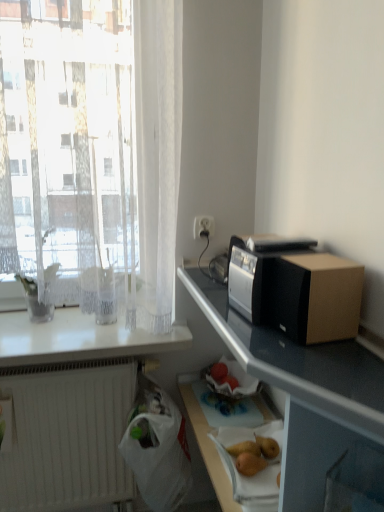
Locate an element on the screen. black plastic microwave at right is located at coordinates (257, 272).

What do you see at coordinates (254, 454) in the screenshot?
I see `smooth brown pear at lower center` at bounding box center [254, 454].

This screenshot has width=384, height=512. Identify the location of smooth brown pear at lower center. (254, 454).

What do you see at coordinates (67, 438) in the screenshot?
I see `white matte radiator at lower left` at bounding box center [67, 438].

What do you see at coordinates (302, 392) in the screenshot? I see `black matte microwave at upper right` at bounding box center [302, 392].

What do you see at coordinates (79, 339) in the screenshot? I see `white glossy countertop at upper left` at bounding box center [79, 339].

This screenshot has width=384, height=512. Find the location of `black plastic microwave at right`. black plastic microwave at right is located at coordinates (257, 272).

Considering the sizes of objects white plastic electric outlet at upper center and white matte radiator at lower left in the image provided, who is smaller, white plastic electric outlet at upper center or white matte radiator at lower left?

white plastic electric outlet at upper center is smaller.

Is white plastic electric outlet at upper center spatially inside white matte radiator at lower left, or outside of it?

white plastic electric outlet at upper center is not inside white matte radiator at lower left, it's outside.

What are the coordinates of `radiator that is below the white plastic electric outlet at upper center (from the image's perspective)` in the screenshot? It's located at (67, 438).

Between brown cardboard box at right and white glossy countertop at upper left, which one has less height?

white glossy countertop at upper left.

In the scene shown: Considering the relative positions of brown cardboard box at right and white glossy countertop at upper left in the image provided, is brown cardboard box at right behind white glossy countertop at upper left?

No, it is not.

Is brown cardboard box at right facing away from white glossy countertop at upper left?

No, brown cardboard box at right is not facing the opposite direction of white glossy countertop at upper left.

From the image's perspective, does brown cardboard box at right appear lower than white glossy countertop at upper left?

No, from the image's perspective, brown cardboard box at right is not beneath white glossy countertop at upper left.

Which is closer to the camera, [7,350] or [96,411]?

Point [7,350] is closer to the camera than point [96,411].

Is white glossy countertop at upper left bigger than white matte radiator at lower left?

Incorrect, white glossy countertop at upper left is not larger than white matte radiator at lower left.

Looking at this image, considering the sizes of objects white glossy countertop at upper left and white matte radiator at lower left in the image provided, who is taller, white glossy countertop at upper left or white matte radiator at lower left?

With more height is white matte radiator at lower left.

Considering the sizes of objects white glossy countertop at upper left and white matte radiator at lower left in the image provided, who is thinner, white glossy countertop at upper left or white matte radiator at lower left?

white matte radiator at lower left.

From the image's perspective, is smooth brown pear at lower center located above or below white plastic electric outlet at upper center?

Based on their image positions, smooth brown pear at lower center is located beneath white plastic electric outlet at upper center.

What's the angular difference between smooth brown pear at lower center and white plastic electric outlet at upper center's facing directions?

The angular difference between smooth brown pear at lower center and white plastic electric outlet at upper center is 89.8 degrees.

Which is closer to the camera, [273,448] or [195,233]?

Point [273,448] is positioned closer to the camera compared to point [195,233].

You are a GUI agent. You are given a task and a screenshot of the screen. Output one action in this format:
    pyautogui.click(x=<x>, y=<y>)
    Task: Click on the fruit to the right of white plastic electric outlet at upper center
    The width and height of the screenshot is (384, 512).
    Given the screenshot: What is the action you would take?
    click(254, 454)

Considering the relative sizes of brown cardboard box at right and white plastic bag at lower center in the image provided, is brown cardboard box at right thinner than white plastic bag at lower center?

Yes, brown cardboard box at right is thinner than white plastic bag at lower center.

From a real-world perspective, which object rests below the other?

white plastic bag at lower center is physically lower.

Based on the photo, considering the positions of objects brown cardboard box at right and white plastic bag at lower center in the image provided, who is more to the right, brown cardboard box at right or white plastic bag at lower center?

brown cardboard box at right is more to the right.

Can we say black matte microwave at upper right lies outside brown cardboard box at right?

That's correct, black matte microwave at upper right is outside of brown cardboard box at right.

Between black matte microwave at upper right and brown cardboard box at right, which one is positioned in front?

black matte microwave at upper right is more forward.

Can you confirm if black matte microwave at upper right is bigger than brown cardboard box at right?

Yes.

Does black matte microwave at upper right appear on the left side of brown cardboard box at right?

Yes, black matte microwave at upper right is to the left of brown cardboard box at right.

Considering the sizes of objects white glossy countertop at upper left and black matte microwave at upper right in the image provided, who is bigger, white glossy countertop at upper left or black matte microwave at upper right?

With larger size is black matte microwave at upper right.

From the image's perspective, is white glossy countertop at upper left positioned above or below black matte microwave at upper right?

From the image's perspective, white glossy countertop at upper left appears above black matte microwave at upper right.

Which object is wider, white glossy countertop at upper left or black matte microwave at upper right?

Wider between the two is white glossy countertop at upper left.

Is white glossy countertop at upper left not near black matte microwave at upper right?

That's not correct — white glossy countertop at upper left is a little close to black matte microwave at upper right.

You are a GUI agent. You are given a task and a screenshot of the screen. Output one action in this format:
    pyautogui.click(x=<x>, y=<y>)
    Task: Click on the radiator below the white plastic electric outlet at upper center (from the image's perspective)
    The width and height of the screenshot is (384, 512).
    Given the screenshot: What is the action you would take?
    pyautogui.click(x=67, y=438)

The height and width of the screenshot is (512, 384). What are the coordinates of `cardboard box in front of the white glossy countertop at upper left` in the screenshot? It's located at (316, 297).

Looking at the image, which one is located closer to white matte radiator at lower left, brown cardboard box at right or smooth brown pear at lower center?

smooth brown pear at lower center.

When comparing their distances from white plastic bag at lower center, does black plastic microwave at right or black matte microwave at upper right seem closer?

black matte microwave at upper right is positioned closer to the anchor white plastic bag at lower center.

Consider the image. Estimate the real-world distances between objects in this image. Which object is further from brown cardboard box at right, white plastic electric outlet at upper center or white matte radiator at lower left?

Among the two, white matte radiator at lower left is located further to brown cardboard box at right.

Which object lies nearer to the anchor point black plastic microwave at right, white matte radiator at lower left or white plastic bag at lower center?

white plastic bag at lower center lies closer to black plastic microwave at right than the other object.

From the image, which object appears to be nearer to white plastic electric outlet at upper center, white plastic bag at lower center or smooth brown pear at lower center?

white plastic bag at lower center lies closer to white plastic electric outlet at upper center than the other object.

When comparing their distances from white plastic bag at lower center, does white glossy countertop at upper left or black plastic microwave at right seem closer?

The object closer to white plastic bag at lower center is white glossy countertop at upper left.

From the image, which object appears to be farther from brown cardboard box at right, white plastic electric outlet at upper center or white glossy countertop at upper left?

white glossy countertop at upper left.

Which object lies further to the anchor point smooth brown pear at lower center, black matte microwave at upper right or black plastic microwave at right?

The object further to smooth brown pear at lower center is black plastic microwave at right.

The image size is (384, 512). Identify the location of fruit between brown cardboard box at right and white plastic bag at lower center in the up-down direction. (254, 454).

You are a GUI agent. You are given a task and a screenshot of the screen. Output one action in this format:
    pyautogui.click(x=<x>, y=<y>)
    Task: Click on the fruit located between black matte microwave at upper right and white matte radiator at lower left in the depth direction
    
    Given the screenshot: What is the action you would take?
    pyautogui.click(x=254, y=454)

This screenshot has width=384, height=512. I want to click on appliance located between black matte microwave at upper right and white glossy countertop at upper left in the depth direction, so click(x=257, y=272).

The width and height of the screenshot is (384, 512). I want to click on shopping bag between white plastic electric outlet at upper center and white matte radiator at lower left vertically, so click(x=157, y=448).